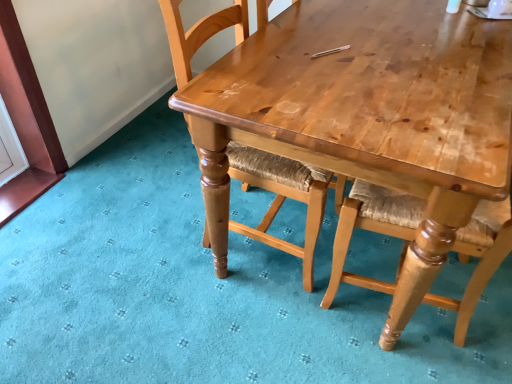
Question: From the image's perspective, is wooden woven seat at center located above or below light brown wood table at upper center?

Choices:
 (A) below
 (B) above

Answer: (B)

Question: Is point (177, 82) closer or farther from the camera than point (328, 99)?

Choices:
 (A) closer
 (B) farther

Answer: (B)

Question: Relative to light brown wood table at upper center, is wooden woven seat at center in front or behind?

Choices:
 (A) front
 (B) behind

Answer: (B)

Question: Is light brown wood table at upper center wider or thinner than wooden woven seat at center?

Choices:
 (A) thin
 (B) wide

Answer: (B)

Question: Which is correct: light brown wood table at upper center is inside wooden woven seat at center, or outside of it?

Choices:
 (A) outside
 (B) inside

Answer: (A)

Question: From the image's perspective, is light brown wood table at upper center above or below wooden woven seat at center?

Choices:
 (A) below
 (B) above

Answer: (A)

Question: Based on their sizes in the image, would you say light brown wood table at upper center is bigger or smaller than wooden woven seat at center?

Choices:
 (A) small
 (B) big

Answer: (B)